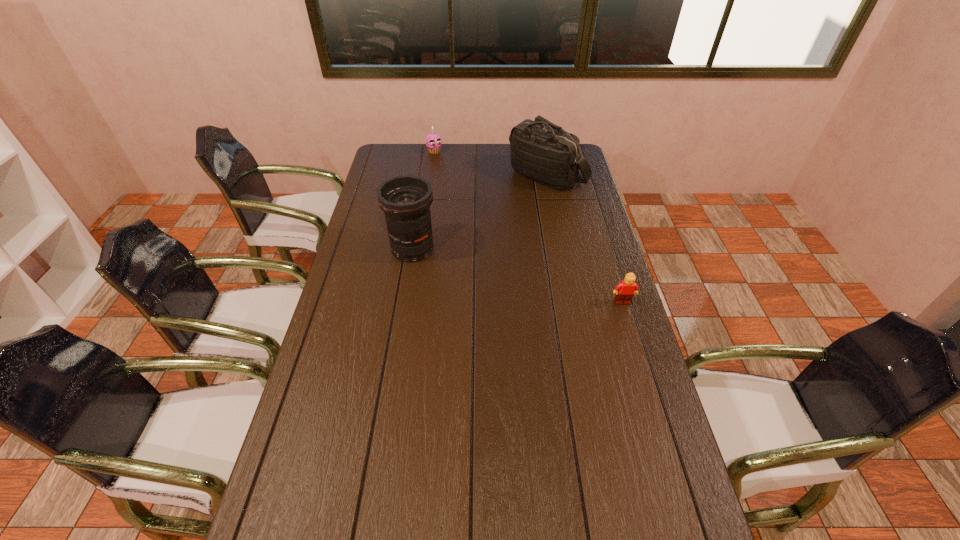
The width and height of the screenshot is (960, 540). I want to click on telephoto lens, so click(406, 200).

What are the coordinates of `the nearest object` in the screenshot? It's located at (625, 290).

You are a GUI agent. You are given a task and a screenshot of the screen. Output one action in this format:
    pyautogui.click(x=<x>, y=<y>)
    Task: Click on the second farthest object
    
    Given the screenshot: What is the action you would take?
    pyautogui.click(x=541, y=151)

Find the location of `cupcake`. cupcake is located at coordinates (433, 140).

You are a GUI agent. You are given a task and a screenshot of the screen. Output one action in this format:
    pyautogui.click(x=<x>, y=<y>)
    Task: Click on the vacant space situated 0.050m on the left of the telephoto lens
    
    Given the screenshot: What is the action you would take?
    pyautogui.click(x=373, y=249)

Locate an element on the screen. vacant position located 0.300m on the face of the nearest object is located at coordinates (649, 390).

The image size is (960, 540). I want to click on free region located at the front padded panel of the shoulder bag, so click(497, 252).

Find the location of a particular element. This screenshot has width=960, height=540. vacant space located at the front padded panel of the shoulder bag is located at coordinates (522, 212).

Locate an element on the screen. This screenshot has width=960, height=540. free space located 0.280m at the front padded panel of the shoulder bag is located at coordinates (510, 233).

Image resolution: width=960 pixels, height=540 pixels. What are the coordinates of `free spot located on the face of the farthest object` in the screenshot? It's located at (455, 182).